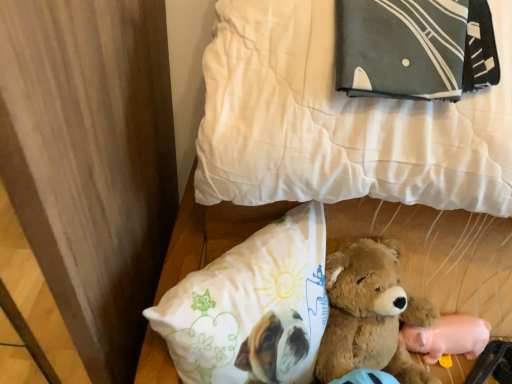
Question: Is white quilted bed at upper center far from white fabric pillow at lower center, arranged as the 1th pillow when ordered from the bottom?

Choices:
 (A) no
 (B) yes

Answer: (A)

Question: Is white quilted bed at upper center oriented away from white fabric pillow at lower center, arranged as the 1th pillow when ordered from the bottom?

Choices:
 (A) no
 (B) yes

Answer: (A)

Question: Can you confirm if white quilted bed at upper center is smaller than white fabric pillow at lower center, which is the 2th pillow in top-to-bottom order?

Choices:
 (A) yes
 (B) no

Answer: (B)

Question: From a real-world perspective, is white quilted bed at upper center positioned over white fabric pillow at lower center, which is the 2th pillow in top-to-bottom order, based on gravity?

Choices:
 (A) yes
 (B) no

Answer: (B)

Question: From the image's perspective, is white quilted bed at upper center on top of white fabric pillow at lower center, which is the 2th pillow in top-to-bottom order?

Choices:
 (A) no
 (B) yes

Answer: (B)

Question: In terms of height, does pink rubber pig at lower right look taller or shorter compared to white fabric pillow at lower center, arranged as the 1th pillow when ordered from the bottom?

Choices:
 (A) tall
 (B) short

Answer: (B)

Question: From a real-world perspective, is pink rubber pig at lower right physically located above or below white fabric pillow at lower center, arranged as the 1th pillow when ordered from the bottom?

Choices:
 (A) above
 (B) below

Answer: (B)

Question: Is pink rubber pig at lower right in front of or behind white fabric pillow at lower center, arranged as the 1th pillow when ordered from the bottom, in the image?

Choices:
 (A) behind
 (B) front

Answer: (A)

Question: Considering the positions of pink rubber pig at lower right and white fabric pillow at lower center, which is the 2th pillow in top-to-bottom order, in the image, is pink rubber pig at lower right bigger or smaller than white fabric pillow at lower center, which is the 2th pillow in top-to-bottom order,?

Choices:
 (A) small
 (B) big

Answer: (A)

Question: Considering the positions of point (446, 317) and point (417, 218), is point (446, 317) closer or farther from the camera than point (417, 218)?

Choices:
 (A) farther
 (B) closer

Answer: (A)

Question: From a real-world perspective, is pink rubber pig at lower right above or below white quilted bed at upper center?

Choices:
 (A) above
 (B) below

Answer: (B)

Question: Considering the positions of pink rubber pig at lower right and white quilted bed at upper center in the image, is pink rubber pig at lower right wider or thinner than white quilted bed at upper center?

Choices:
 (A) thin
 (B) wide

Answer: (A)

Question: In terms of height, does pink rubber pig at lower right look taller or shorter compared to white quilted bed at upper center?

Choices:
 (A) short
 (B) tall

Answer: (A)

Question: In terms of size, does white quilted bed at upper center appear bigger or smaller than white fabric pillow at lower center, arranged as the 1th pillow when ordered from the bottom?

Choices:
 (A) small
 (B) big

Answer: (B)

Question: From a real-world perspective, is white quilted bed at upper center above or below white fabric pillow at lower center, which is the 2th pillow in top-to-bottom order?

Choices:
 (A) above
 (B) below

Answer: (B)